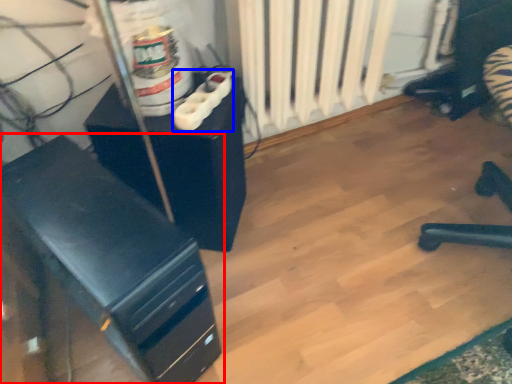
Question: Among these objects, which one is farthest to the camera, furniture (highlighted by a red box) or plug (highlighted by a blue box)?

Choices:
 (A) furniture
 (B) plug

Answer: (B)